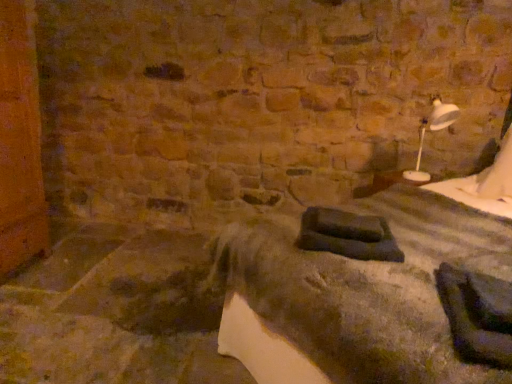
Question: Is white plastic lamp at upper right wider than dark gray fabric bed at center?

Choices:
 (A) yes
 (B) no

Answer: (B)

Question: Would you say white plastic lamp at upper right is a long distance from dark gray fabric bed at center?

Choices:
 (A) no
 (B) yes

Answer: (B)

Question: Can you confirm if white plastic lamp at upper right is positioned to the left of dark gray fabric bed at center?

Choices:
 (A) yes
 (B) no

Answer: (B)

Question: Can you confirm if white plastic lamp at upper right is positioned to the right of dark gray fabric bed at center?

Choices:
 (A) no
 (B) yes

Answer: (B)

Question: Can you confirm if white plastic lamp at upper right is taller than dark gray fabric bed at center?

Choices:
 (A) no
 (B) yes

Answer: (A)

Question: Could you tell me if white plastic lamp at upper right is turned towards dark gray fabric bed at center?

Choices:
 (A) no
 (B) yes

Answer: (B)

Question: Can you confirm if dark gray fabric bed at center is shorter than white plastic lamp at upper right?

Choices:
 (A) yes
 (B) no

Answer: (B)

Question: Are dark gray fabric bed at center and white plastic lamp at upper right beside each other?

Choices:
 (A) no
 (B) yes

Answer: (A)

Question: Is dark gray fabric bed at center closer to camera compared to white plastic lamp at upper right?

Choices:
 (A) no
 (B) yes

Answer: (B)

Question: Is dark gray fabric bed at center to the right of white plastic lamp at upper right from the viewer's perspective?

Choices:
 (A) no
 (B) yes

Answer: (A)

Question: Considering the relative positions of dark gray fabric bed at center and white plastic lamp at upper right in the image provided, is dark gray fabric bed at center to the left of white plastic lamp at upper right from the viewer's perspective?

Choices:
 (A) no
 (B) yes

Answer: (B)

Question: From the image's perspective, does dark gray fabric bed at center appear lower than white plastic lamp at upper right?

Choices:
 (A) yes
 (B) no

Answer: (A)

Question: Is white plastic lamp at upper right inside the boundaries of dark gray fabric bed at center, or outside?

Choices:
 (A) inside
 (B) outside

Answer: (A)